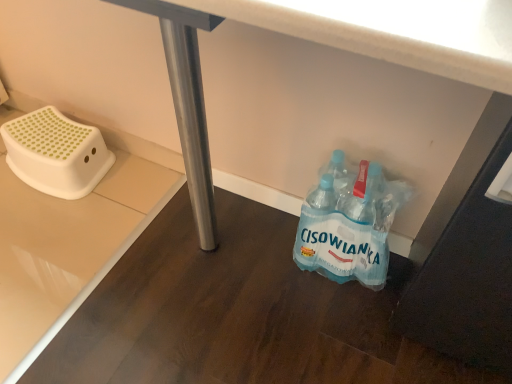
Where is `translucent plastic bottles at lower right`? Image resolution: width=512 pixels, height=384 pixels. translucent plastic bottles at lower right is located at coordinates (349, 224).

What do you see at coordinates (349, 224) in the screenshot?
I see `translucent plastic bottles at lower right` at bounding box center [349, 224].

Image resolution: width=512 pixels, height=384 pixels. Identify the location of translucent plastic bottles at lower right. (349, 224).